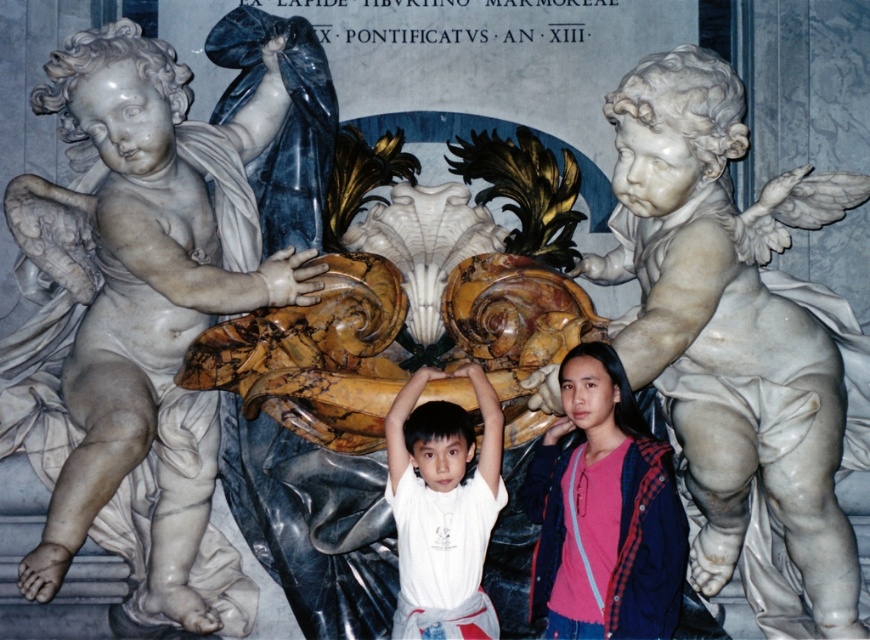
You are standing in front of the classical sculpture described. You see the white marble cherub at left and the white matte shirt at center. Which object is positioned more to the left?

The white marble cherub at left is positioned more to the left than the white matte shirt at center.